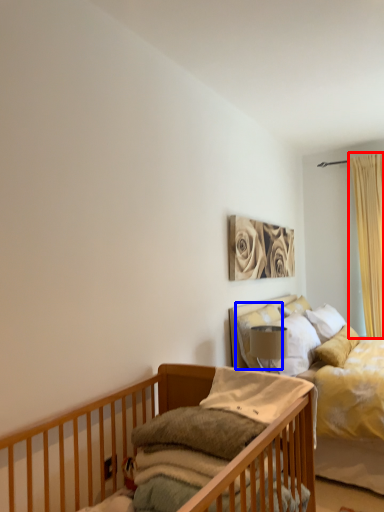
Question: Which object is closer to the camera taking this photo, curtain (highlighted by a red box) or pillow (highlighted by a blue box)?

Choices:
 (A) curtain
 (B) pillow

Answer: (B)